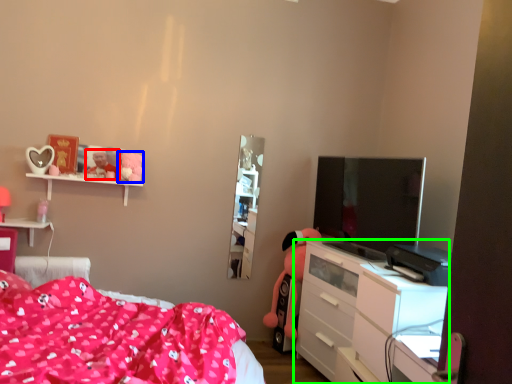
Question: Which object is the closest to the toy (highlighted by a red box)? Choose among these: toy (highlighted by a blue box) or chest of drawers (highlighted by a green box).

Choices:
 (A) toy
 (B) chest of drawers

Answer: (A)